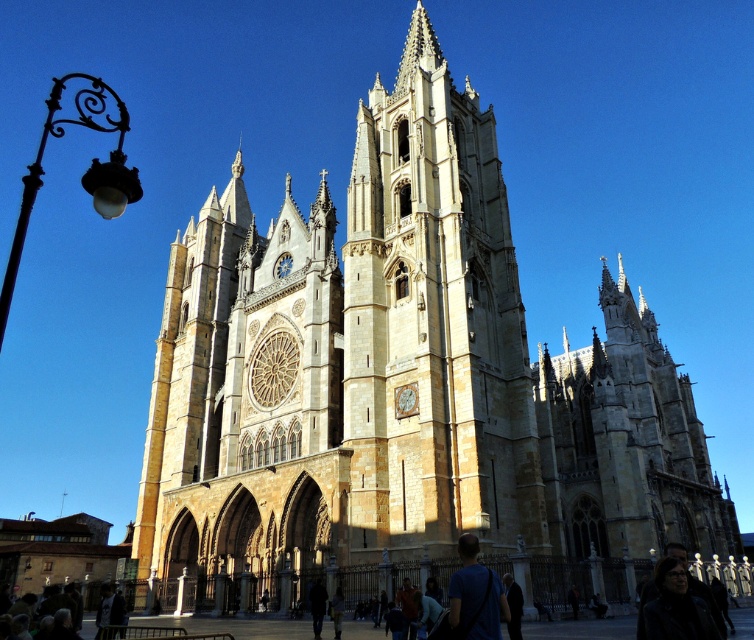
In the scene shown: You are standing in the plaza in front of the cathedral and see two points marked on the ground. The first point is at coordinates point (694, 604) and the second is at point (477, 630). Which point is closer to you as you face the cathedral?

Point (694, 604) is in front of point (477, 630), so it is closer to you when facing the cathedral.

You are standing in the plaza in front of the cathedral. You see a point marked at coordinates point (434, 326). What part of the cathedral does this point belong to?

The point (434, 326) is on the light beige stone tower at center.